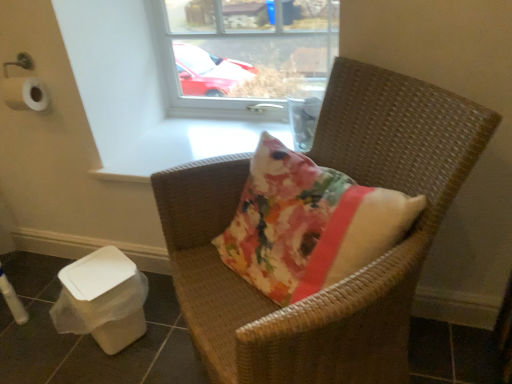
Question: Considering the relative sizes of woven brown chair at center and transparent glass window at upper center in the image provided, is woven brown chair at center smaller than transparent glass window at upper center?

Choices:
 (A) yes
 (B) no

Answer: (B)

Question: Is woven brown chair at center closer to the viewer compared to transparent glass window at upper center?

Choices:
 (A) yes
 (B) no

Answer: (A)

Question: Considering the relative sizes of woven brown chair at center and transparent glass window at upper center in the image provided, is woven brown chair at center taller than transparent glass window at upper center?

Choices:
 (A) no
 (B) yes

Answer: (B)

Question: Considering the relative sizes of woven brown chair at center and transparent glass window at upper center in the image provided, is woven brown chair at center thinner than transparent glass window at upper center?

Choices:
 (A) yes
 (B) no

Answer: (B)

Question: Considering the relative sizes of woven brown chair at center and transparent glass window at upper center in the image provided, is woven brown chair at center bigger than transparent glass window at upper center?

Choices:
 (A) yes
 (B) no

Answer: (A)

Question: From the image's perspective, is woven brown chair at center over transparent glass window at upper center?

Choices:
 (A) yes
 (B) no

Answer: (B)

Question: From the image's perspective, is white plastic potty at lower left beneath transparent glass window at upper center?

Choices:
 (A) no
 (B) yes

Answer: (B)

Question: Is white plastic potty at lower left at the left side of transparent glass window at upper center?

Choices:
 (A) yes
 (B) no

Answer: (A)

Question: From the image's perspective, is white plastic potty at lower left on top of transparent glass window at upper center?

Choices:
 (A) yes
 (B) no

Answer: (B)

Question: Considering the relative positions of white plastic potty at lower left and transparent glass window at upper center in the image provided, is white plastic potty at lower left to the right of transparent glass window at upper center from the viewer's perspective?

Choices:
 (A) no
 (B) yes

Answer: (A)

Question: Is white plastic potty at lower left positioned beyond the bounds of transparent glass window at upper center?

Choices:
 (A) yes
 (B) no

Answer: (A)

Question: Is white plastic potty at lower left bigger than transparent glass window at upper center?

Choices:
 (A) no
 (B) yes

Answer: (A)

Question: From the image's perspective, is transparent glass window at upper center above woven brown chair at center?

Choices:
 (A) no
 (B) yes

Answer: (B)